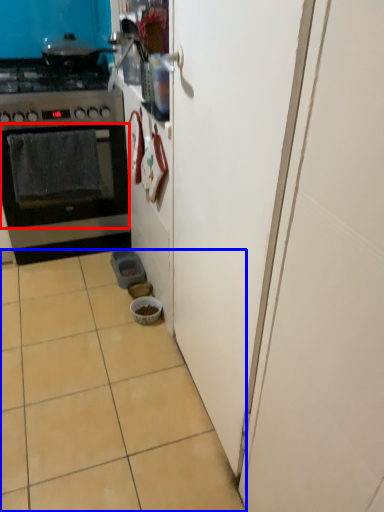
Question: Which object appears closest to the camera in this image, oven (highlighted by a red box) or ceramic tile (highlighted by a blue box)?

Choices:
 (A) oven
 (B) ceramic tile

Answer: (B)